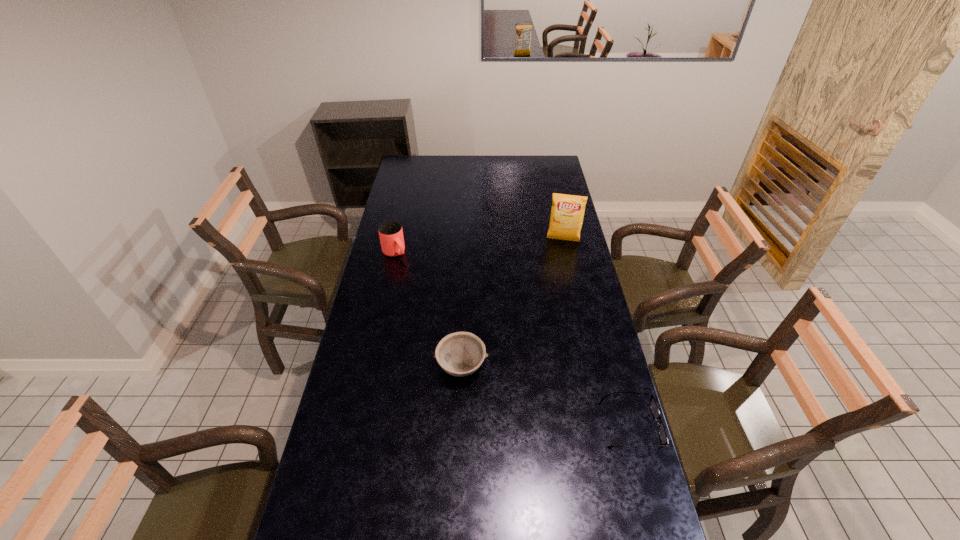
The height and width of the screenshot is (540, 960). Identify the location of free space located on the front of the crisp (potato chip) with the logo. (560, 258).

The image size is (960, 540). What are the coordinates of `free space located 0.280m on the handle side of the third shortest object` in the screenshot? It's located at (435, 298).

The width and height of the screenshot is (960, 540). I want to click on free region located 0.050m on the handle side of the third shortest object, so click(406, 267).

Image resolution: width=960 pixels, height=540 pixels. In order to click on vacant region located 0.210m on the handle side of the third shortest object in this screenshot , I will do `click(426, 288)`.

The height and width of the screenshot is (540, 960). In order to click on object at the left edge in this screenshot , I will do `click(390, 232)`.

At what (x,y) coordinates should I click in order to perform the action: click on spectacles present at the right edge. Please return your answer as a coordinate pair (x, y). The width and height of the screenshot is (960, 540). Looking at the image, I should click on (653, 404).

What are the coordinates of `crisp (potato chip) that is at the right edge` in the screenshot? It's located at (567, 212).

This screenshot has width=960, height=540. I want to click on vacant region at the far edge of the desktop, so click(481, 163).

At what (x,y) coordinates should I click in order to perform the action: click on free point at the near edge. Please return your answer as a coordinate pair (x, y). Looking at the image, I should click on (473, 521).

The height and width of the screenshot is (540, 960). I want to click on vacant space at the left edge, so pos(366,294).